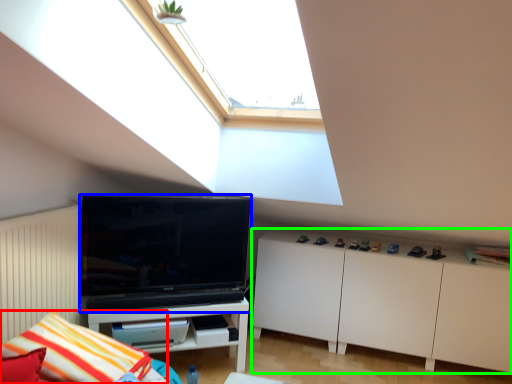
Question: Which is nearer to the pillow (highlighted by a red box)? television (highlighted by a blue box) or cabinetry (highlighted by a green box).

Choices:
 (A) television
 (B) cabinetry

Answer: (A)